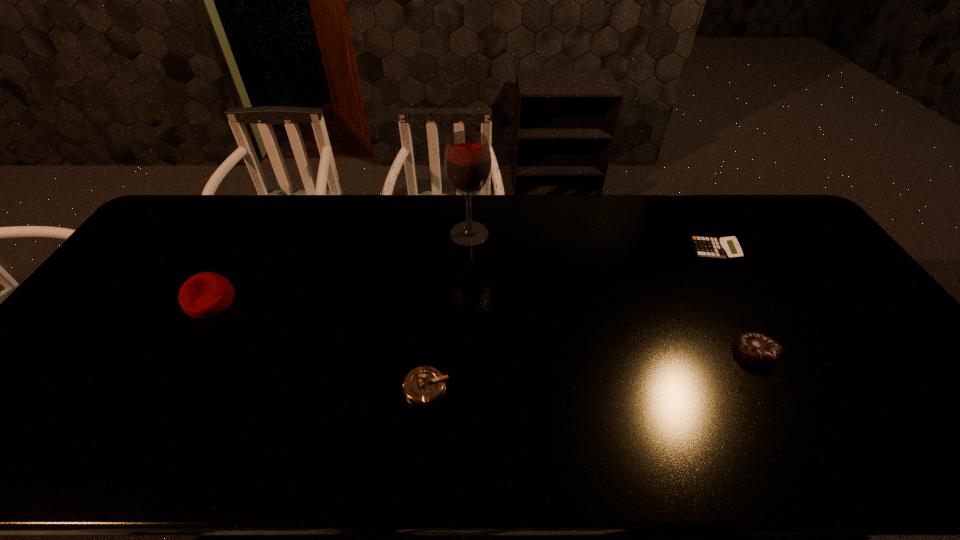
Identify the location of blank space located 0.370m on the left of the calculator. The width and height of the screenshot is (960, 540). (576, 251).

Where is `free space located 0.290m on the left of the ashtray`? This screenshot has width=960, height=540. free space located 0.290m on the left of the ashtray is located at coordinates (284, 387).

You are a GUI agent. You are given a task and a screenshot of the screen. Output one action in this format:
    pyautogui.click(x=<x>, y=<y>)
    Task: Click on the object at the far edge
    The image size is (960, 540).
    Given the screenshot: What is the action you would take?
    pyautogui.click(x=467, y=159)

Locate an element on the screen. free spot at the far edge of the desktop is located at coordinates click(343, 208).

This screenshot has height=540, width=960. In order to click on free point at the near edge in this screenshot , I will do `click(476, 462)`.

This screenshot has width=960, height=540. I want to click on free region at the right edge, so click(x=809, y=249).

This screenshot has width=960, height=540. What are the coordinates of `vacant area that lies between the calculator and the third tallest object` in the screenshot? It's located at (734, 302).

Locate an element on the screen. The width and height of the screenshot is (960, 540). vacant space that's between the ashtray and the right beanbag is located at coordinates (590, 370).

You are a GUI agent. You are given a task and a screenshot of the screen. Output one action in this format:
    pyautogui.click(x=<x>, y=<y>)
    Task: Click on the vacant space that's between the calculator and the ashtray
    This screenshot has width=960, height=540.
    Given the screenshot: What is the action you would take?
    pyautogui.click(x=570, y=319)

The width and height of the screenshot is (960, 540). Identify the location of unoccupied area between the left beanbag and the ashtray. (318, 344).